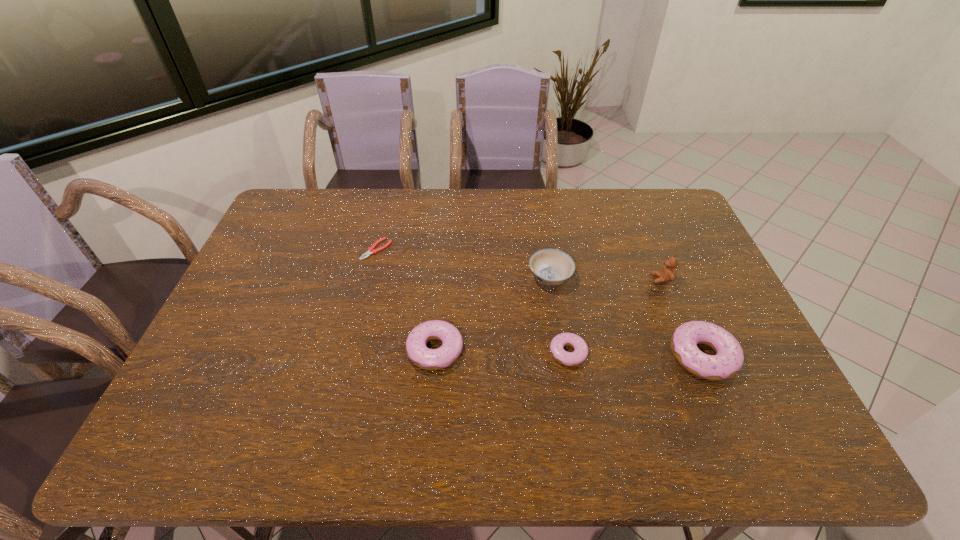
Find the location of a particular element. The width and height of the screenshot is (960, 540). vacant area located 0.170m on the back of the shortest doughnut is located at coordinates (558, 292).

The width and height of the screenshot is (960, 540). I want to click on vacant position located 0.320m on the left of the rightmost doughnut, so click(547, 355).

This screenshot has height=540, width=960. Find the location of `vacant space situated 0.110m on the left of the bowl`. vacant space situated 0.110m on the left of the bowl is located at coordinates (492, 277).

In order to click on vacant region located 0.170m on the back of the farthest object in this screenshot , I will do `click(387, 208)`.

Identify the location of free space located on the face of the teddy bear. This screenshot has height=540, width=960. (593, 279).

In order to click on vacant space located on the face of the teddy bear in this screenshot , I will do `click(538, 279)`.

The width and height of the screenshot is (960, 540). Find the location of `free space located 0.350m on the face of the teddy bear`. free space located 0.350m on the face of the teddy bear is located at coordinates (538, 279).

Where is `object positioned at the near edge`? object positioned at the near edge is located at coordinates (729, 358).

Identify the location of doughnut positioned at the right edge. (729, 358).

This screenshot has width=960, height=540. In order to click on teddy bear located in the right edge section of the desktop in this screenshot , I will do `click(667, 274)`.